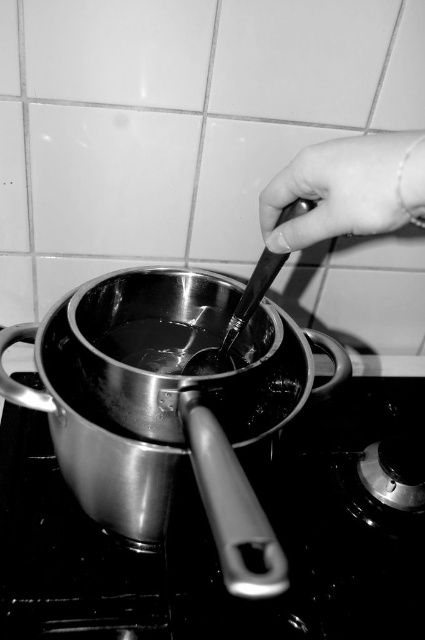
You are a chef holding a black matte spoon at center and need to reach the metallic at upper right. Which direction should you move your hand to grab it?

The metallic at upper right is to the right of the black matte spoon at center, so you should move your hand to the right to grab it.